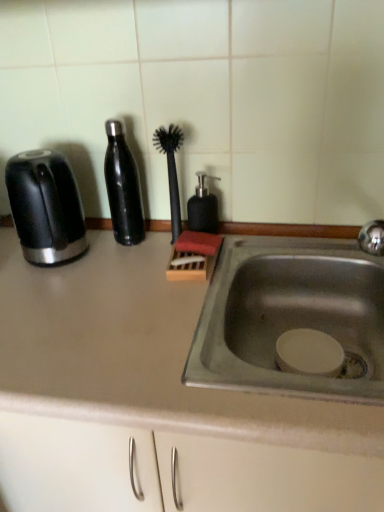
Where is `vacant space in front of black glossy toaster at left`? The height and width of the screenshot is (512, 384). vacant space in front of black glossy toaster at left is located at coordinates (48, 293).